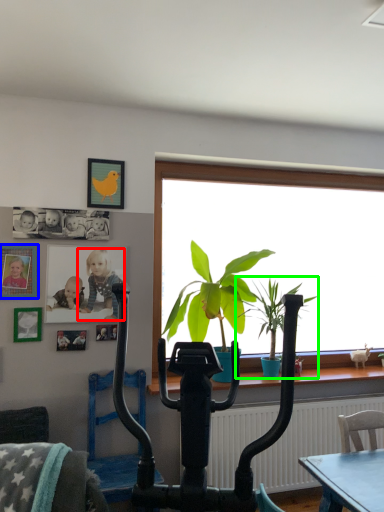
Question: Which is farther away from person (highlighted by a red box)? picture frame (highlighted by a blue box) or houseplant (highlighted by a green box)?

Choices:
 (A) picture frame
 (B) houseplant

Answer: (B)